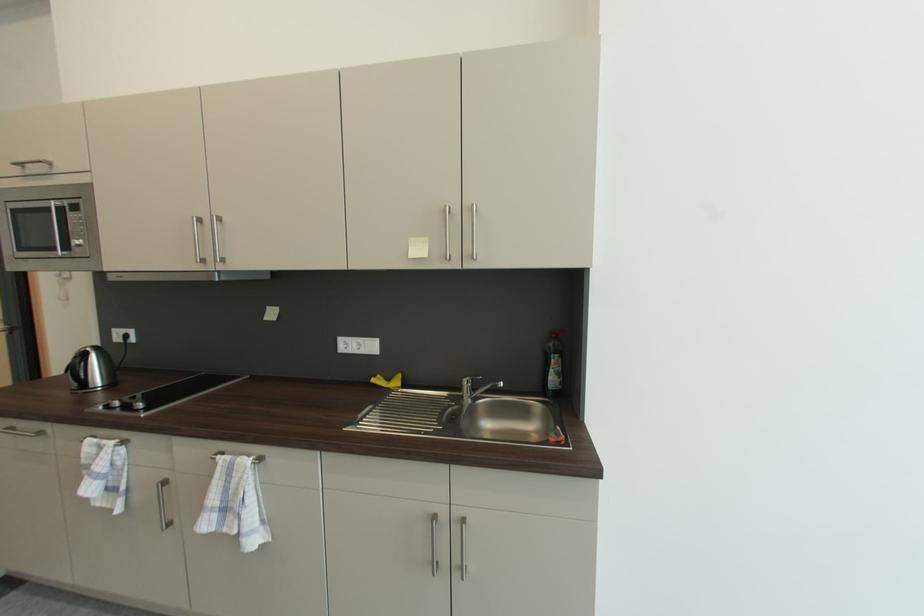
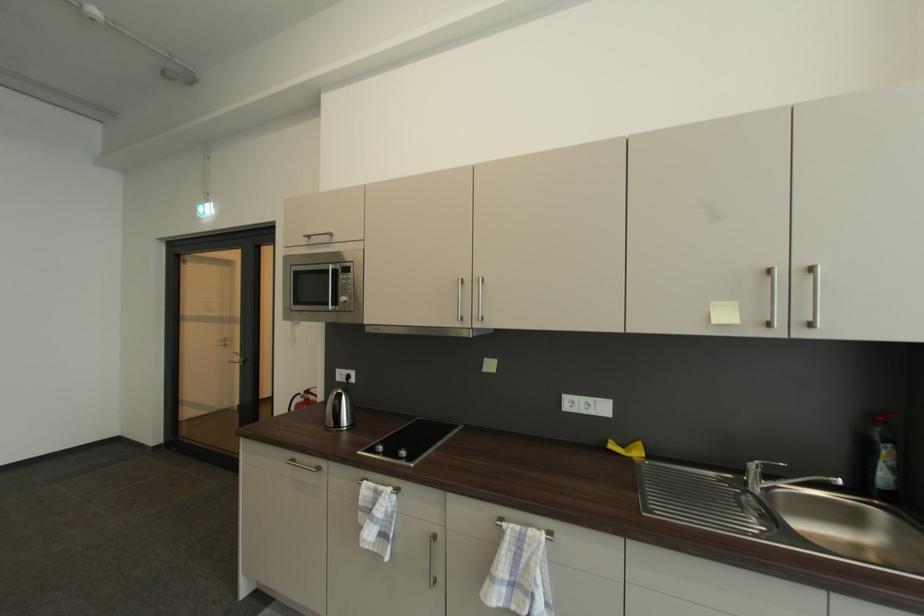
The point at (62,252) is marked in the first image. Where is the corresponding point in the second image?

(334, 306)